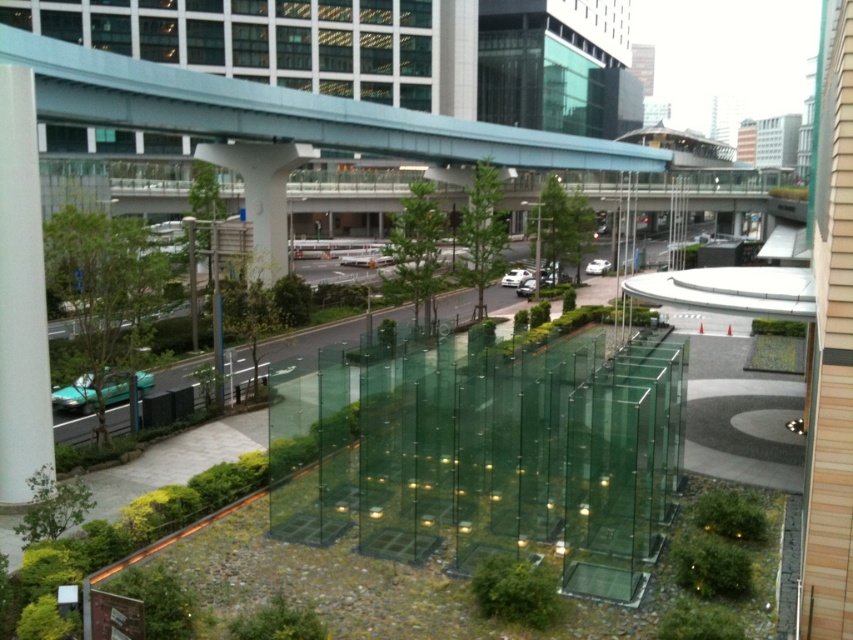
Is transparent glass window at upper center behind white smooth pillar at left?

That is True.

Can you confirm if transparent glass window at upper center is smaller than white smooth pillar at left?

No, transparent glass window at upper center is not smaller than white smooth pillar at left.

Is point (347, 74) behind point (4, 490)?

That is True.

Where is `transparent glass window at upper center`? This screenshot has height=640, width=853. transparent glass window at upper center is located at coordinates (259, 38).